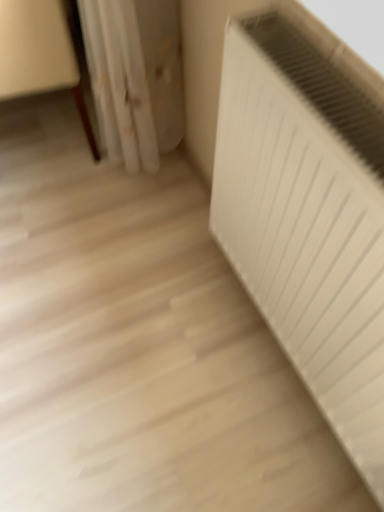
Identify the location of blank space situated above white matte radiator at right (from a real-world perspective). (311, 95).